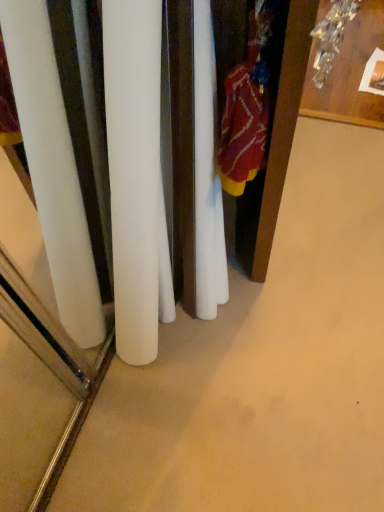
Question: Would you say wooden table at upper right is outside wooden armoire at right?

Choices:
 (A) no
 (B) yes

Answer: (B)

Question: Does wooden table at upper right have a lesser height compared to wooden armoire at right?

Choices:
 (A) no
 (B) yes

Answer: (B)

Question: Could wooden armoire at right be considered to be inside wooden table at upper right?

Choices:
 (A) yes
 (B) no

Answer: (B)

Question: Are wooden table at upper right and wooden armoire at right located far from each other?

Choices:
 (A) yes
 (B) no

Answer: (B)

Question: Does wooden table at upper right have a smaller size compared to wooden armoire at right?

Choices:
 (A) no
 (B) yes

Answer: (B)

Question: Is point (261, 61) closer or farther from the camera than point (322, 3)?

Choices:
 (A) farther
 (B) closer

Answer: (B)

Question: Is knitted wool sweater at right situated inside wooden table at upper right or outside?

Choices:
 (A) outside
 (B) inside

Answer: (A)

Question: Considering the positions of knitted wool sweater at right and wooden table at upper right in the image, is knitted wool sweater at right wider or thinner than wooden table at upper right?

Choices:
 (A) wide
 (B) thin

Answer: (B)

Question: Is knitted wool sweater at right in front of or behind wooden table at upper right in the image?

Choices:
 (A) behind
 (B) front

Answer: (B)

Question: Is wooden table at upper right taller or shorter than wooden armoire at right?

Choices:
 (A) short
 (B) tall

Answer: (A)

Question: Relative to wooden armoire at right, is wooden table at upper right in front or behind?

Choices:
 (A) front
 (B) behind

Answer: (B)

Question: Considering the relative positions of wooden table at upper right and wooden armoire at right in the image provided, is wooden table at upper right to the left or to the right of wooden armoire at right?

Choices:
 (A) right
 (B) left

Answer: (A)

Question: From the image's perspective, is wooden table at upper right located above or below wooden armoire at right?

Choices:
 (A) above
 (B) below

Answer: (A)

Question: Is wooden armoire at right bigger or smaller than wooden table at upper right?

Choices:
 (A) small
 (B) big

Answer: (B)

Question: Relative to wooden table at upper right, is wooden armoire at right in front or behind?

Choices:
 (A) front
 (B) behind

Answer: (A)